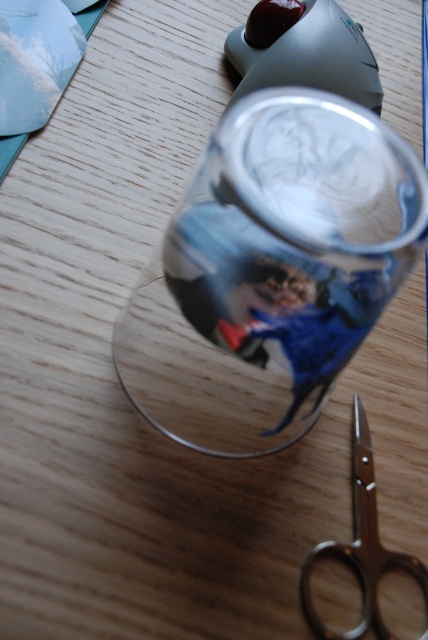
You are organizing items on a table and need to place a decorative item between the transparent glass cup at center and the polished silver scissors at lower right. Based on their positions, where should you place it?

Since the transparent glass cup at center is located above the polished silver scissors at lower right, you should place the decorative item between them either below the cup and above the scissors or along the vertical space separating them.

You are organizing items on a table and need to place a new object between the transparent glass cup at center and the polished silver scissors at lower right. Is there enough space between them to fit a small 5 cm wide book?

The transparent glass cup at center is to the left of polished silver scissors at lower right, so there is space between them. The 5 cm wide book can be placed between the transparent glass cup at center and the polished silver scissors at lower right.